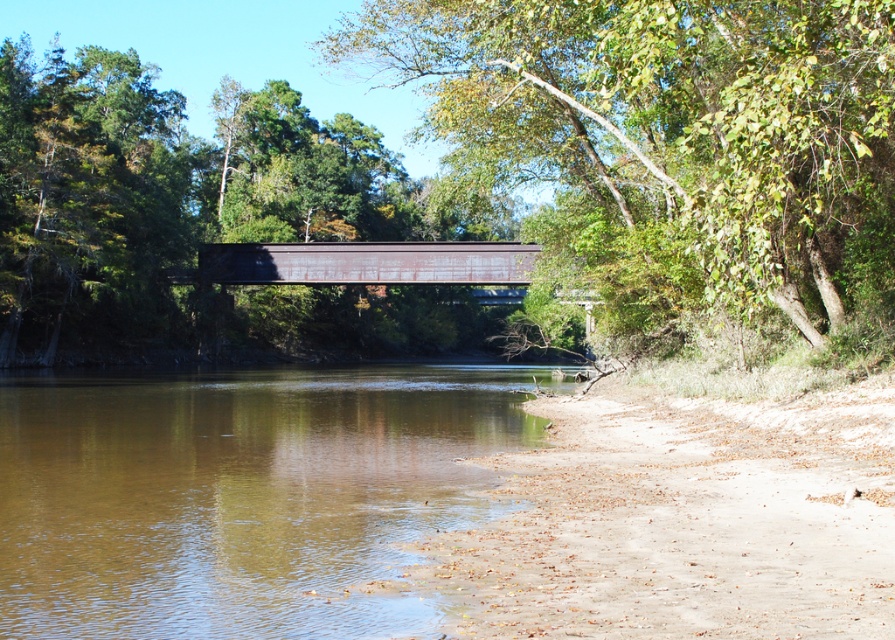
Question: Which point is closer to the camera?

Choices:
 (A) rusty metal bridge at center
 (B) green leafy tree at upper center
 (C) brown sedimentary water at lower left

Answer: (C)

Question: Which object appears farthest from the camera in this image?

Choices:
 (A) rusty metal bridge at center
 (B) brown sedimentary water at lower left
 (C) green leafy tree at upper center

Answer: (A)

Question: Is green leafy tree at upper center to the left of rusty metal bridge at center from the viewer's perspective?

Choices:
 (A) no
 (B) yes

Answer: (B)

Question: Can you confirm if green leafy tree at upper center is bigger than brown sedimentary water at lower left?

Choices:
 (A) yes
 (B) no

Answer: (A)

Question: Which object appears closest to the camera in this image?

Choices:
 (A) brown sedimentary water at lower left
 (B) rusty metal bridge at center
 (C) green leafy tree at upper center

Answer: (A)

Question: Can you confirm if green leafy tree at upper center is positioned to the left of brown sedimentary water at lower left?

Choices:
 (A) no
 (B) yes

Answer: (B)